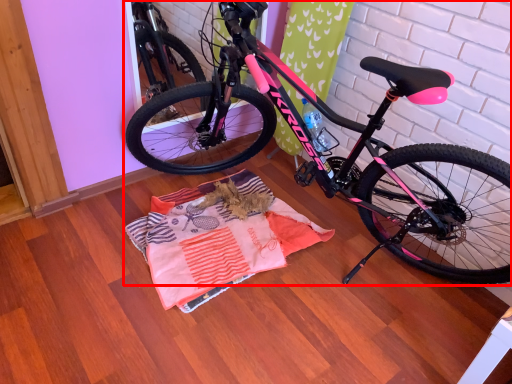
Question: From the image's perspective, what is the correct spatial relationship of bicycle (annotated by the red box) in relation to blanket?

Choices:
 (A) above
 (B) below

Answer: (A)